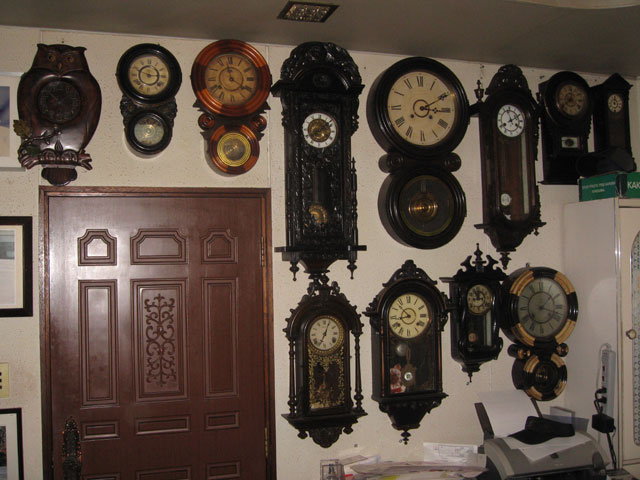
Locate an element on the screen. This screenshot has width=640, height=480. clocks with plain round tops is located at coordinates (541, 287), (435, 105), (228, 78), (150, 79).